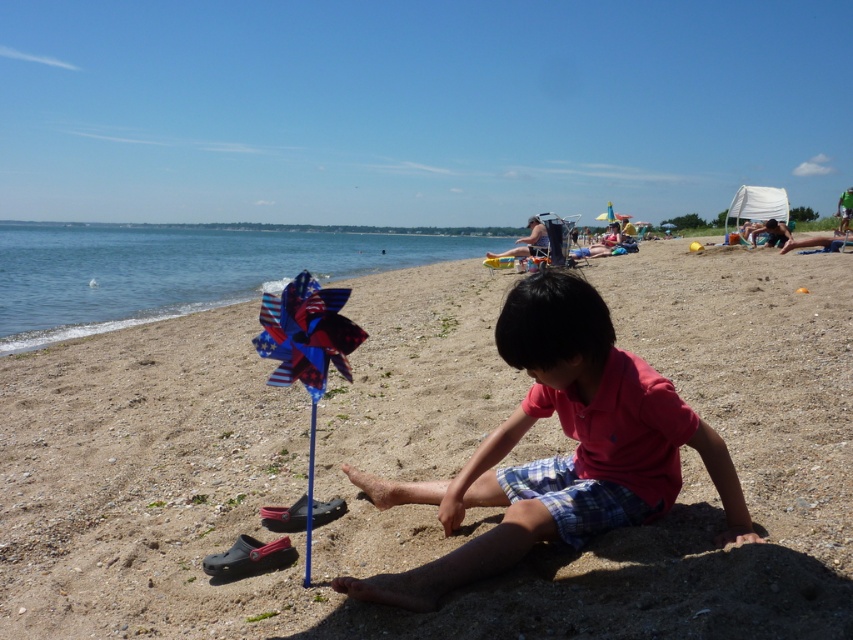
You are standing on the beach and want to place a small flag exactly where the smooth sand at center is located. According to the coordinates provided, where should you place the flag?

You should place the flag at the coordinates point (428,461) where the smooth sand at center is located.

Consider the image. You are a photographer at the beach and want to take a picture of the smooth sand at center and the american flag pinwheel at center. Based on their positions, which object should you focus on first if you are moving from left to right across the scene?

The american flag pinwheel at center should be focused on first because the smooth sand at center is positioned to its right side, meaning the pinwheel is on the left when moving from left to right.